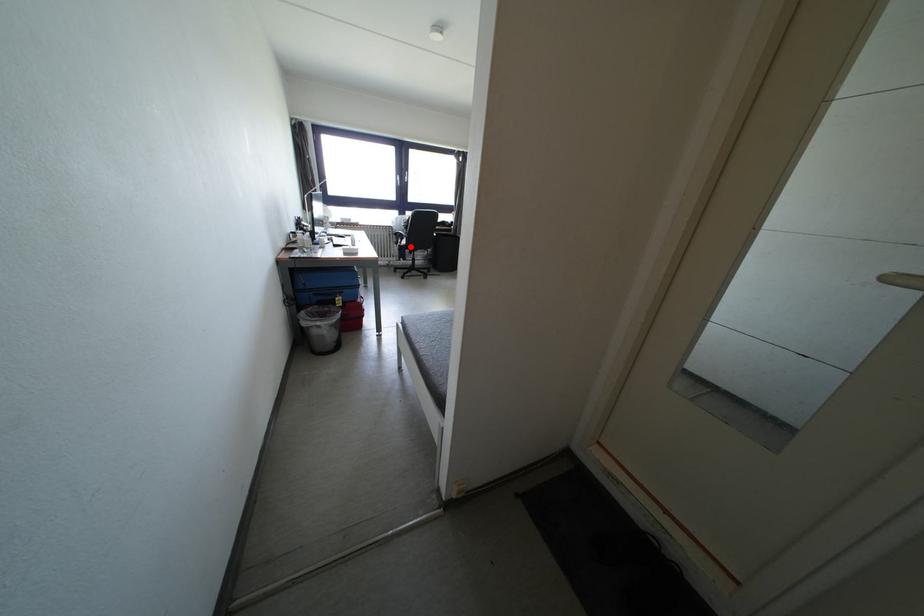
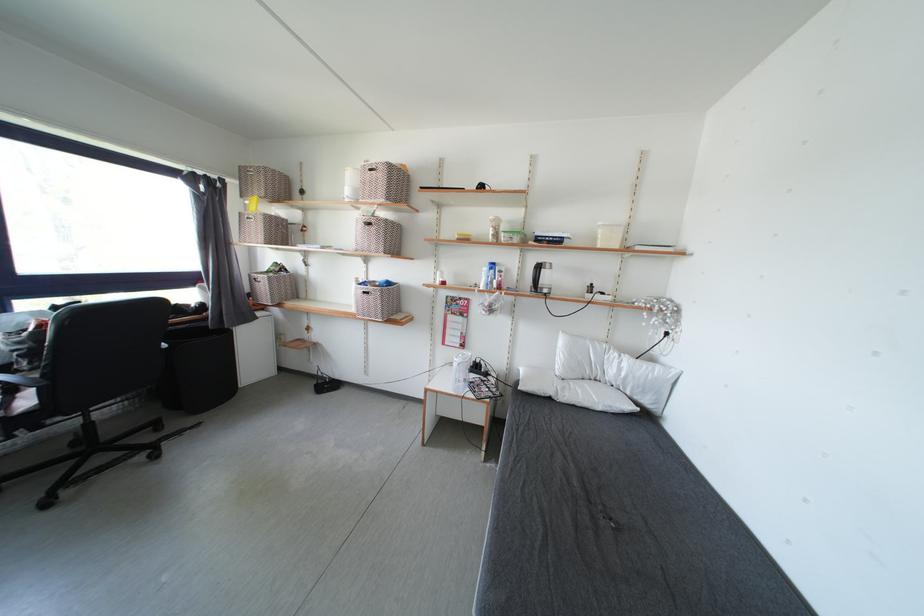
Where in the second image is the point corresponding to the highlighted location from the first image?

(33, 407)